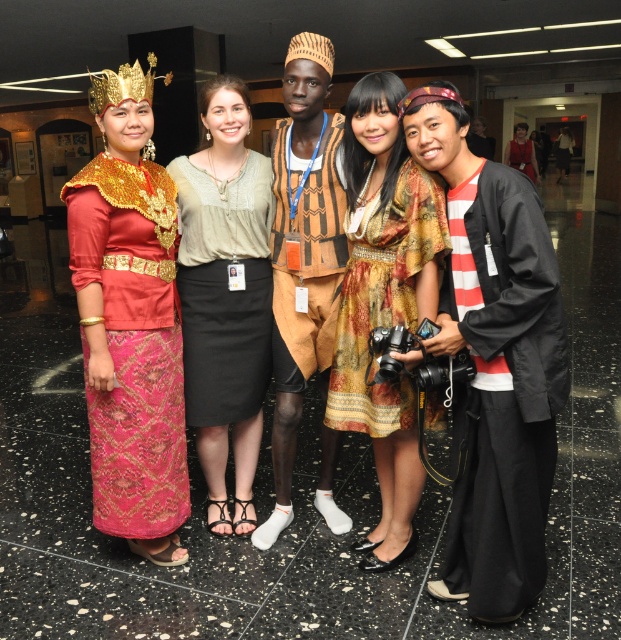
You are standing in the museum hall and need to locate the black matte robe at right and the light beige textured blouse at center. Which one is positioned lower in the image?

The black matte robe at right is located below the light beige textured blouse at center, so it is positioned lower in the image.

You are organizing a photoshoot and need to arrange two outfits from the image side by side. The black matte robe at right and the light beige textured blouse at center must be placed next to each other. Which outfit requires more horizontal space due to its width?

The light beige textured blouse at center requires more horizontal space because it has a greater width than the black matte robe at right.